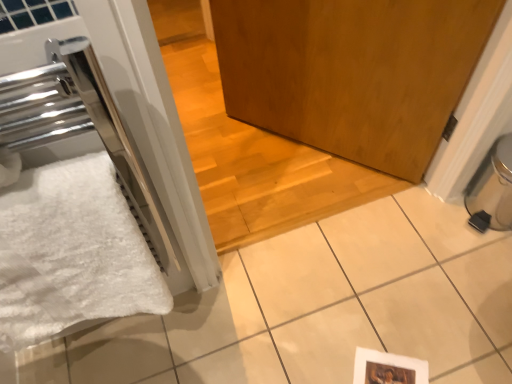
Question: Based on their sizes in the image, would you say white fluffy bath towel at left is bigger or smaller than black plastic water heater at lower right?

Choices:
 (A) small
 (B) big

Answer: (B)

Question: Which is correct: white fluffy bath towel at left is inside black plastic water heater at lower right, or outside of it?

Choices:
 (A) inside
 (B) outside

Answer: (B)

Question: Which object is the farthest from the white fluffy bath towel at left?

Choices:
 (A) wooden door at center
 (B) black plastic water heater at lower right

Answer: (B)

Question: Estimate the real-world distances between objects in this image. Which object is closer to the wooden door at center?

Choices:
 (A) white fluffy bath towel at left
 (B) black plastic water heater at lower right

Answer: (B)